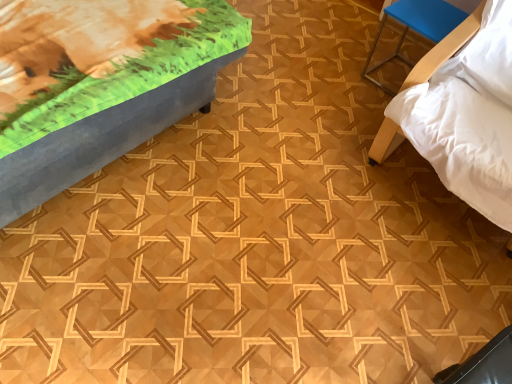
This screenshot has height=384, width=512. Identify the location of free space to the left of blue plastic stool at upper right, marked as the second furniture in a left-to-right arrangement. (348, 71).